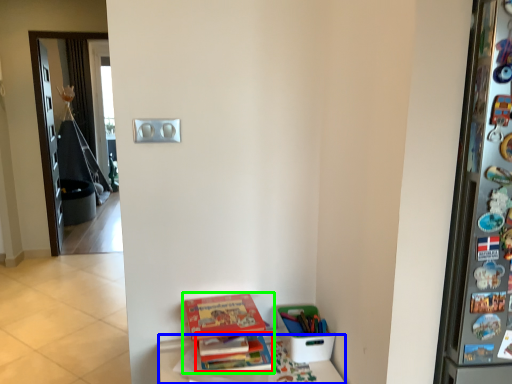
Question: Which object is positioned closest to book (highlighted by a red box)? Select from furniture (highlighted by a blue box) and book (highlighted by a green box).

Choices:
 (A) furniture
 (B) book

Answer: (B)